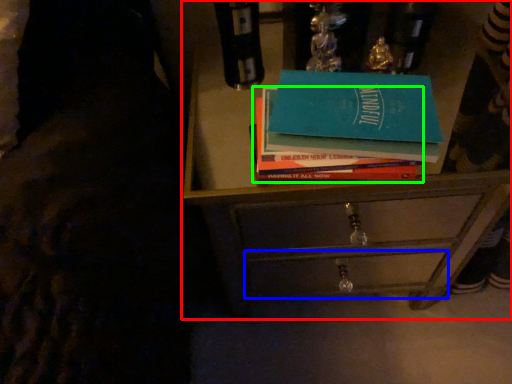
Question: Which object is the closest to the chest of drawers (highlighted by a red box)? Choose among these: drawer (highlighted by a blue box) or book (highlighted by a green box).

Choices:
 (A) drawer
 (B) book

Answer: (A)